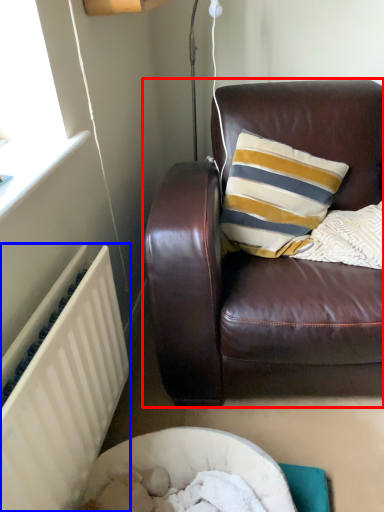
Question: Among these objects, which one is farthest to the camera, studio couch (highlighted by a red box) or radiator (highlighted by a blue box)?

Choices:
 (A) studio couch
 (B) radiator

Answer: (A)